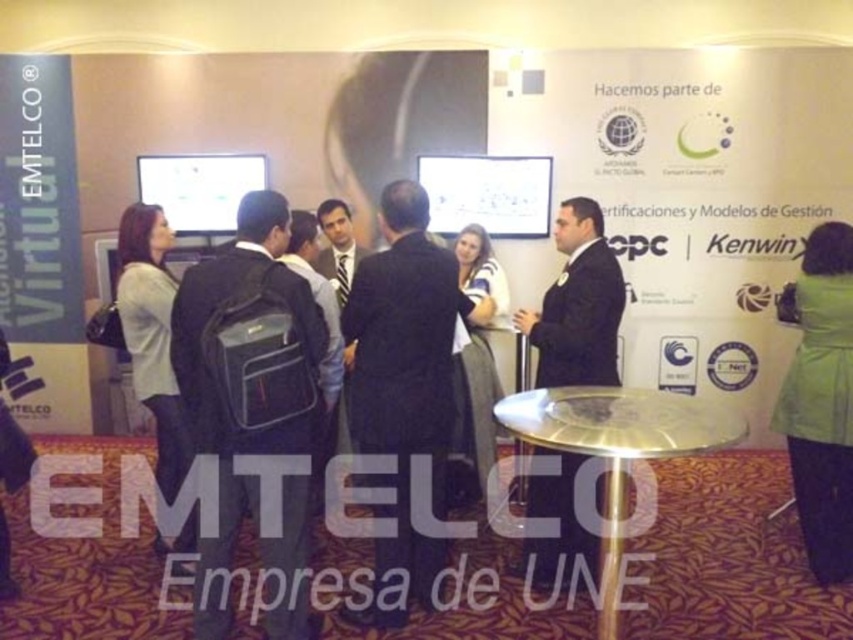
Question: Based on their relative distances, which object is nearer to the green fabric coat at lower right?

Choices:
 (A) dark suit at center
 (B) matte gray blazer at left
 (C) black fabric backpack at center

Answer: (A)

Question: Among these points, which one is nearest to the camera?

Choices:
 (A) (560, 492)
 (B) (230, 458)
 (C) (140, 323)

Answer: (B)

Question: Is dark blue dress at center to the right of matte black backpack at left from the viewer's perspective?

Choices:
 (A) yes
 (B) no

Answer: (A)

Question: Does dark suit at center lie behind matte gray blazer at left?

Choices:
 (A) no
 (B) yes

Answer: (A)

Question: Observing the image, what is the correct spatial positioning of green fabric coat at lower right in reference to dark blue dress at center?

Choices:
 (A) below
 (B) above

Answer: (A)

Question: Which point is closer to the camera?

Choices:
 (A) (466, 372)
 (B) (828, 396)
 (C) (6, 540)

Answer: (C)